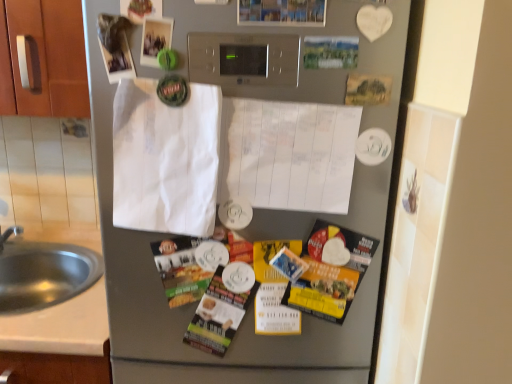
The image size is (512, 384). Find the location of `white paper at center`. white paper at center is located at coordinates (165, 159).

Measure the distance between point [215,160] and camera.

Point [215,160] is 32.13 inches away from camera.

Where is `brushed metal sink at lower left`? Image resolution: width=512 pixels, height=384 pixels. brushed metal sink at lower left is located at coordinates pyautogui.click(x=42, y=273).

Does point (231, 372) appear closer or farther from the camera than point (172, 262)?

Point (231, 372) is farther from the camera than point (172, 262).

Considering the sizes of objects satin silver refrigerator at center and matte paper magazine at center, the second magazine when ordered from right to left, in the image provided, who is bigger, satin silver refrigerator at center or matte paper magazine at center, the second magazine when ordered from right to left,?

Bigger between the two is satin silver refrigerator at center.

Which object is wider, satin silver refrigerator at center or matte paper magazine at center, the second magazine when ordered from right to left?

Wider between the two is matte paper magazine at center, the second magazine when ordered from right to left.

From the image's perspective, which is below, satin silver refrigerator at center or matte paper magazine at center, the second magazine when ordered from right to left?

matte paper magazine at center, the second magazine when ordered from right to left.

Is white paper at center positioned with its back to yellow paper flyer at lower right?

No, yellow paper flyer at lower right is not at the back of white paper at center.

From the picture: Is white paper at center smaller than yellow paper flyer at lower right?

Correct, white paper at center occupies less space than yellow paper flyer at lower right.

From the image's perspective, is white paper at center located above yellow paper flyer at lower right?

Correct, white paper at center appears higher than yellow paper flyer at lower right in the image.

Looking at this image, is yellow paper flyer at lower right surrounded by white paper at center?

Definitely not — yellow paper flyer at lower right is not inside white paper at center.

From a real-world perspective, which object rests below the other?

matte plastic magazine at center, marked as the second magazine in a left-to-right arrangement, from a real-world perspective.

Who is more distant, matte plastic magazine at center, marked as the second magazine in a left-to-right arrangement, or yellow paper flyer at lower right?

yellow paper flyer at lower right is further away from the camera.

Is matte plastic magazine at center, positioned as the first magazine in right-to-left order, directly adjacent to yellow paper flyer at lower right?

No, matte plastic magazine at center, positioned as the first magazine in right-to-left order, is not next to yellow paper flyer at lower right.

Considering the relative positions of matte plastic magazine at center, positioned as the first magazine in right-to-left order, and yellow paper flyer at lower right in the image provided, is matte plastic magazine at center, positioned as the first magazine in right-to-left order, to the left or to the right of yellow paper flyer at lower right?

From the image, it's evident that matte plastic magazine at center, positioned as the first magazine in right-to-left order, is to the left of yellow paper flyer at lower right.

Looking at the image, does satin silver refrigerator at center seem bigger or smaller compared to brushed metal sink at lower left?

Considering their sizes, satin silver refrigerator at center takes up less space than brushed metal sink at lower left.

Between satin silver refrigerator at center and brushed metal sink at lower left, which one has less height?

With less height is brushed metal sink at lower left.

Which object is further away from the camera taking this photo, satin silver refrigerator at center or brushed metal sink at lower left?

brushed metal sink at lower left is further away from the camera.

From the picture: Does satin silver refrigerator at center have a greater width compared to brushed metal sink at lower left?

No.

Is white paper at center wider than brushed metal sink at lower left?

No.

Who is smaller, white paper at center or brushed metal sink at lower left?

With smaller size is white paper at center.

From a real-world perspective, is white paper at center on top of brushed metal sink at lower left?

Yes, from a real-world perspective, white paper at center is above brushed metal sink at lower left.

Based on the photo, considering the sizes of objects matte paper magazine at center, placed as the first magazine when sorted from left to right, and brushed metal sink at lower left in the image provided, who is wider, matte paper magazine at center, placed as the first magazine when sorted from left to right, or brushed metal sink at lower left?

Wider between the two is brushed metal sink at lower left.

From a real-world perspective, which object stands above the other?

From a 3D spatial view, matte paper magazine at center, the second magazine when ordered from right to left, is above.

Considering their positions, is white paper at center located in front of or behind matte plastic magazine at center, marked as the second magazine in a left-to-right arrangement?

In the image, white paper at center appears in front of matte plastic magazine at center, marked as the second magazine in a left-to-right arrangement.

From the image's perspective, which one is positioned higher, white paper at center or matte plastic magazine at center, positioned as the first magazine in right-to-left order?

From the image's view, white paper at center is above.

How many degrees apart are the facing directions of white paper at center and matte plastic magazine at center, positioned as the first magazine in right-to-left order?

The facing directions of white paper at center and matte plastic magazine at center, positioned as the first magazine in right-to-left order, are 4.41 degrees apart.

From a real-world perspective, between white paper at center and matte plastic magazine at center, marked as the second magazine in a left-to-right arrangement, who is vertically lower?

In real-world perspective, matte plastic magazine at center, marked as the second magazine in a left-to-right arrangement, is lower.

Image resolution: width=512 pixels, height=384 pixels. In order to click on refrigerator positioned vertically above the matte paper magazine at center, the second magazine when ordered from right to left (from a real-world perspective) in this screenshot , I will do pos(195,303).

This screenshot has height=384, width=512. What are the coordinates of `flyer behind the white paper at center` in the screenshot? It's located at (330, 271).

Which object lies further to the anchor point white paper at center, white paper at center or matte plastic magazine at center, positioned as the first magazine in right-to-left order?

Among the two, matte plastic magazine at center, positioned as the first magazine in right-to-left order, is located further to white paper at center.

From the image, which object appears to be nearer to white paper at center, brushed metal sink at lower left or white paper at center?

Based on the image, white paper at center appears to be nearer to white paper at center.

Considering their positions, is yellow paper flyer at lower right positioned further to brushed metal sink at lower left than satin silver refrigerator at center?

yellow paper flyer at lower right is further to brushed metal sink at lower left.

Looking at the image, which one is located closer to matte plastic magazine at center, marked as the second magazine in a left-to-right arrangement, white paper at center or brushed metal sink at lower left?

Based on the image, white paper at center appears to be nearer to matte plastic magazine at center, marked as the second magazine in a left-to-right arrangement.

Consider the image. When comparing their distances from white paper at center, does matte paper magazine at center, placed as the first magazine when sorted from left to right, or yellow paper flyer at lower right seem closer?

yellow paper flyer at lower right.

Estimate the real-world distances between objects in this image. Which object is further from yellow paper flyer at lower right, white paper at center or matte plastic magazine at center, marked as the second magazine in a left-to-right arrangement?

matte plastic magazine at center, marked as the second magazine in a left-to-right arrangement, lies further to yellow paper flyer at lower right than the other object.

Estimate the real-world distances between objects in this image. Which object is closer to matte plastic magazine at center, positioned as the first magazine in right-to-left order, yellow paper flyer at lower right or white paper at center?

yellow paper flyer at lower right is closer to matte plastic magazine at center, positioned as the first magazine in right-to-left order.

Which object lies further to the anchor point satin silver refrigerator at center, white paper at center or matte paper magazine at center, placed as the first magazine when sorted from left to right?

Among the two, matte paper magazine at center, placed as the first magazine when sorted from left to right, is located further to satin silver refrigerator at center.

Locate an element on the screen. flyer that lies between white paper at center and matte plastic magazine at center, positioned as the first magazine in right-to-left order, from top to bottom is located at coordinates (330, 271).

At what (x,y) coordinates should I click in order to perform the action: click on envelope between brushed metal sink at lower left and satin silver refrigerator at center. Please return your answer as a coordinate pair (x, y). Looking at the image, I should click on (165, 159).

This screenshot has width=512, height=384. I want to click on refrigerator between white paper at center and yellow paper flyer at lower right, so click(195, 303).

Locate an element on the screen. The width and height of the screenshot is (512, 384). refrigerator between matte paper magazine at center, the second magazine when ordered from right to left, and yellow paper flyer at lower right from left to right is located at coordinates (195, 303).